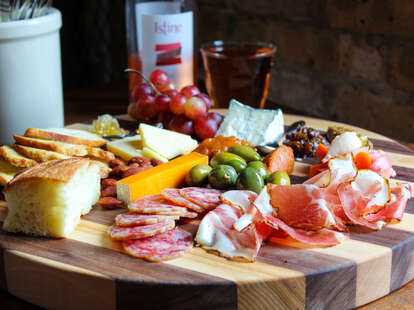
Identify the location of cutting board. (244, 289), (379, 142).